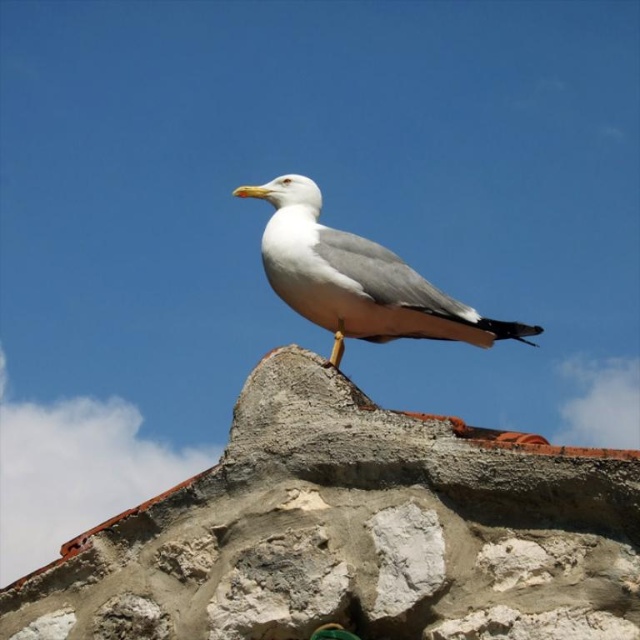
Is rough concrete stone at center to the right of white feathered seagull at center from the viewer's perspective?

Correct, you'll find rough concrete stone at center to the right of white feathered seagull at center.

Looking at this image, between rough concrete stone at center and white feathered seagull at center, which one is positioned higher?

white feathered seagull at center

Image resolution: width=640 pixels, height=640 pixels. What do you see at coordinates (353, 532) in the screenshot?
I see `rough concrete stone at center` at bounding box center [353, 532].

The width and height of the screenshot is (640, 640). What are the coordinates of `rough concrete stone at center` in the screenshot? It's located at (353, 532).